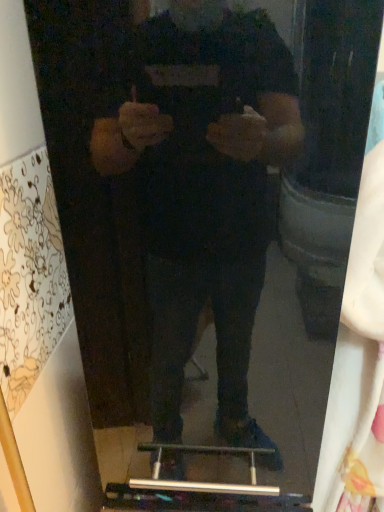
The image size is (384, 512). I want to click on white fabric curtain at right, so click(359, 353).

Measure the distance between white fabric curtain at right and camera.

A distance of 13.48 inches exists between white fabric curtain at right and camera.

Describe the element at coordinates (359, 353) in the screenshot. Image resolution: width=384 pixels, height=512 pixels. I see `white fabric curtain at right` at that location.

At what (x,y) coordinates should I click in order to perform the action: click on white fabric curtain at right. Please return your answer as a coordinate pair (x, y). Image resolution: width=384 pixels, height=512 pixels. Looking at the image, I should click on (359, 353).